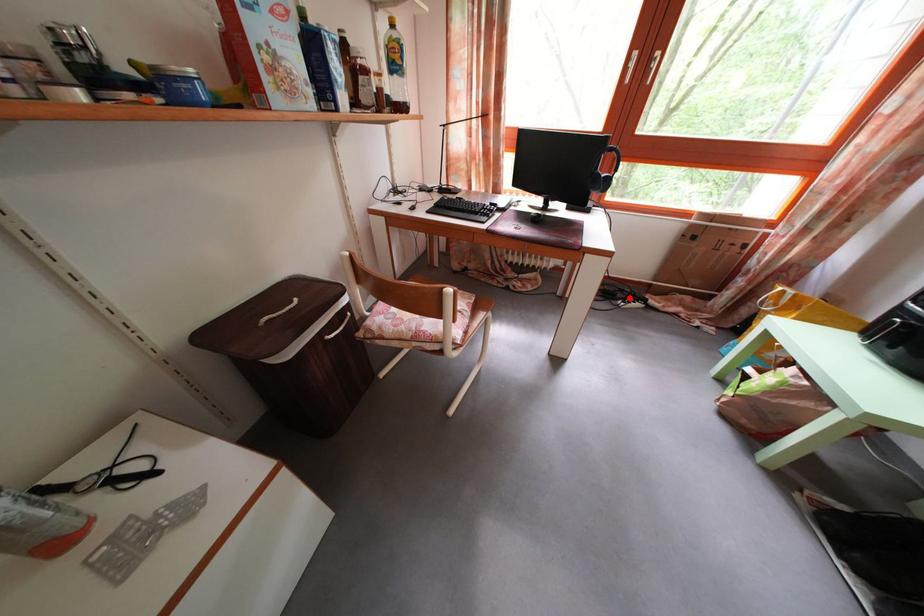
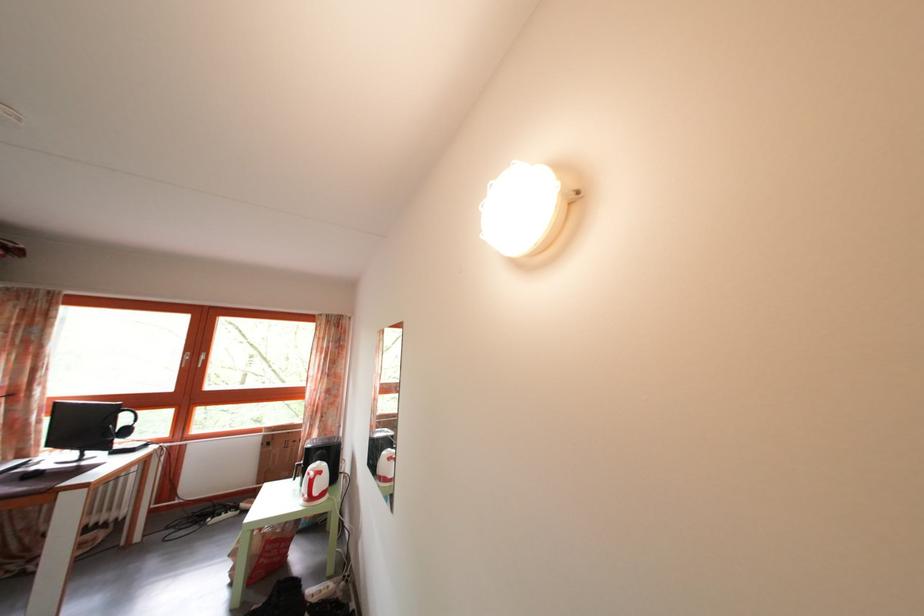
Question: A red point is marked in image1. In image2, is the corresponding 3D point closer to the camera or farther? Reply with the corresponding letter.

Choices:
 (A) The corresponding 3D point is closer.
 (B) The corresponding 3D point is farther.

Answer: (A)